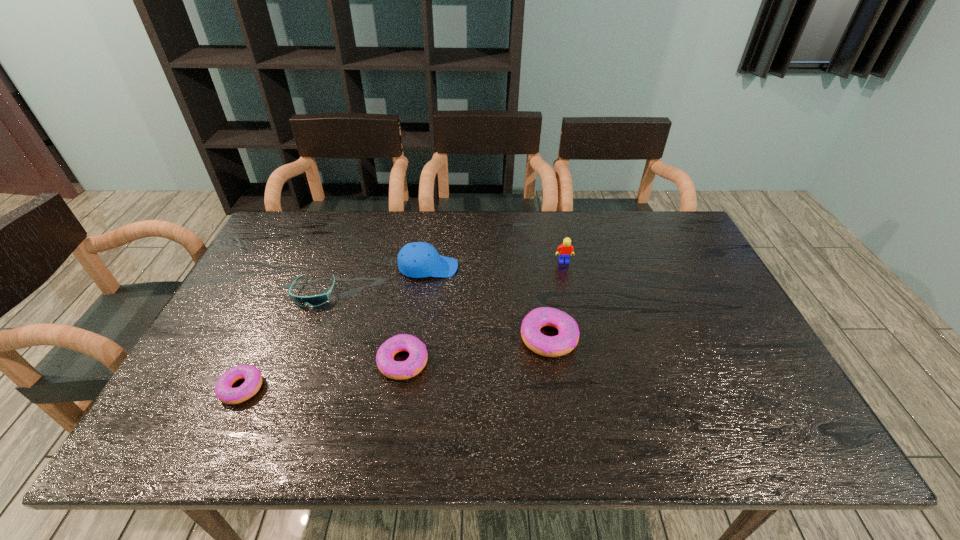
This screenshot has height=540, width=960. What are the coordinates of `the shortest doughnut` in the screenshot? It's located at (225, 393).

Identify the location of the leftmost doughnut. (225, 393).

Identify the location of the second tallest doughnut. (398, 370).

The image size is (960, 540). Identify the location of the rightmost doughnut. (549, 346).

Find the location of a particular element. Image resolution: width=960 pixels, height=540 pixels. the tallest doughnut is located at coordinates (549, 346).

Find the location of a particular element. This screenshot has width=960, height=540. Lego is located at coordinates (566, 249).

You are a GUI agent. You are given a task and a screenshot of the screen. Output one action in this format:
    pyautogui.click(x=<x>, y=<y>)
    Task: Click on the sunglasses
    
    Given the screenshot: What is the action you would take?
    pyautogui.click(x=316, y=300)

This screenshot has height=540, width=960. I want to click on cap, so [418, 259].

You are a GUI agent. You are given a task and a screenshot of the screen. Output one action in this format:
    pyautogui.click(x=<x>, y=<y>)
    Task: Click on the vacant space located on the back of the shortest doughnut
    
    Given the screenshot: What is the action you would take?
    pyautogui.click(x=257, y=354)

Identify the location of free space located 0.370m on the back of the second doughnut from left to right. This screenshot has width=960, height=540. (420, 252).